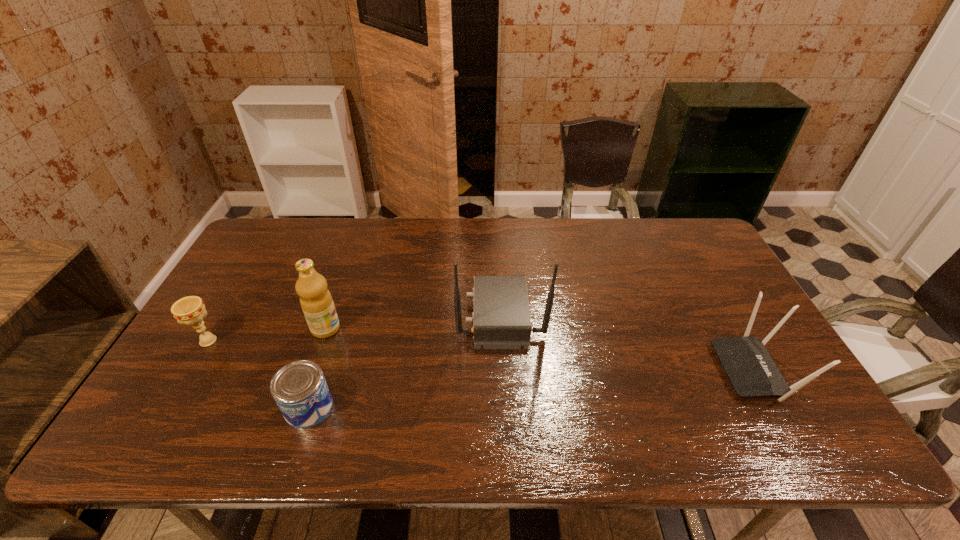
The width and height of the screenshot is (960, 540). Find the location of `free spot located on the label of the second tallest object`. free spot located on the label of the second tallest object is located at coordinates (419, 329).

Where is `free space located 0.050m on the front-facing side of the rightmost object`? This screenshot has height=540, width=960. free space located 0.050m on the front-facing side of the rightmost object is located at coordinates (702, 370).

Identify the location of free space located on the front-facing side of the rightmost object. (612, 370).

Where is `blank area located 0.260m on the front-facing side of the rightmost object`? blank area located 0.260m on the front-facing side of the rightmost object is located at coordinates (619, 370).

You are a GUI agent. You are given a task and a screenshot of the screen. Output one action in this format:
    pyautogui.click(x=<x>, y=<y>)
    Task: Click on the vacant area situated on the back of the leftmost object
    Image resolution: width=960 pixels, height=540 pixels.
    Given the screenshot: What is the action you would take?
    pyautogui.click(x=264, y=247)

Image resolution: width=960 pixels, height=540 pixels. I want to click on vacant space located 0.250m on the front label of the can, so click(437, 407).

Find the location of a particular element. Image resolution: width=960 pixels, height=540 pixels. object present at the near edge is located at coordinates (299, 388).

You are a GUI agent. You are given a task and a screenshot of the screen. Output one action in this format:
    pyautogui.click(x=<x>, y=<y>)
    Task: Click on the object present at the left edge
    Image resolution: width=960 pixels, height=540 pixels.
    Given the screenshot: What is the action you would take?
    pyautogui.click(x=190, y=310)

Where is `object situated at the right edge`? The width and height of the screenshot is (960, 540). object situated at the right edge is located at coordinates (750, 369).

This screenshot has width=960, height=540. In the image, there is a desktop. Identify the location of free space at the far edge. (513, 238).